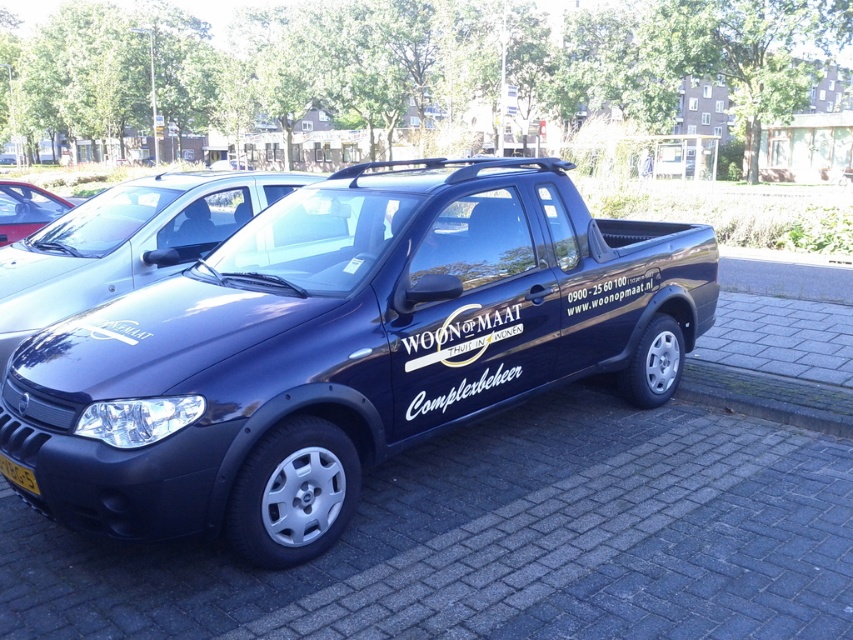
Question: Based on their relative distances, which object is nearer to the glossy dark blue pickup truck at center?

Choices:
 (A) yellow plastic license plate at lower left
 (B) matte black pickup truck at center
 (C) glossy blue truck at center

Answer: (A)

Question: Which point is closer to the camera?

Choices:
 (A) (289, 172)
 (B) (28, 202)

Answer: (B)

Question: Which of the following is the closest to the observer?

Choices:
 (A) glossy dark blue pickup truck at center
 (B) matte black pickup truck at center
 (C) glossy blue truck at center
 (D) yellow plastic license plate at lower left

Answer: (A)

Question: Is glossy dark blue pickup truck at center bigger than matte black pickup truck at center?

Choices:
 (A) no
 (B) yes

Answer: (A)

Question: From the image, what is the correct spatial relationship of glossy blue truck at center in relation to matte black pickup truck at center?

Choices:
 (A) left
 (B) right

Answer: (B)

Question: Considering the relative positions of glossy dark blue pickup truck at center and yellow plastic license plate at lower left in the image provided, where is glossy dark blue pickup truck at center located with respect to yellow plastic license plate at lower left?

Choices:
 (A) right
 (B) left

Answer: (A)